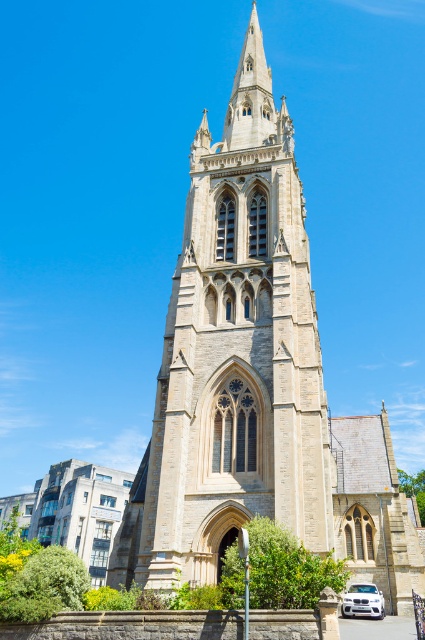
Question: Does beige stone tower at center appear on the right side of white glossy car at lower right?

Choices:
 (A) no
 (B) yes

Answer: (A)

Question: Among these objects, which one is nearest to the camera?

Choices:
 (A) white glossy car at lower right
 (B) beige stone tower at center

Answer: (B)

Question: Is beige stone tower at center to the right of white glossy car at lower right from the viewer's perspective?

Choices:
 (A) no
 (B) yes

Answer: (A)

Question: Considering the relative positions of beige stone tower at center and white glossy car at lower right in the image provided, where is beige stone tower at center located with respect to white glossy car at lower right?

Choices:
 (A) below
 (B) above

Answer: (B)